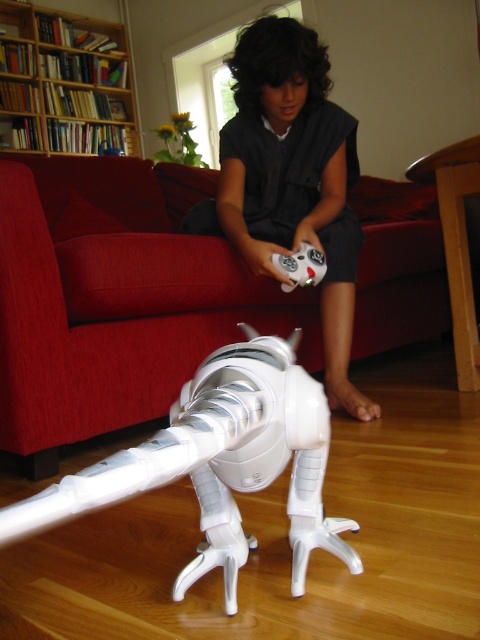
Question: Is wooden bookshelf at upper left positioned behind white matte game controller at center?

Choices:
 (A) yes
 (B) no

Answer: (A)

Question: Which point is closer to the camera?

Choices:
 (A) (68, 516)
 (B) (254, 163)

Answer: (A)

Question: Among these points, which one is nearest to the camera?

Choices:
 (A) (126, 262)
 (B) (41, 42)
 (C) (305, 269)
 (D) (180, 426)

Answer: (D)

Question: Does white plastic toy at lower center lie in front of wooden bookshelf at upper left?

Choices:
 (A) no
 (B) yes

Answer: (B)

Question: Which object appears closest to the camera in this image?

Choices:
 (A) dark gray fabric shirt at center
 (B) red fabric couch at lower center
 (C) white plastic toy at lower center
 (D) white matte game controller at center

Answer: (C)

Question: Can you confirm if white plastic toy at lower center is positioned above dark gray fabric shirt at center?

Choices:
 (A) no
 (B) yes

Answer: (A)